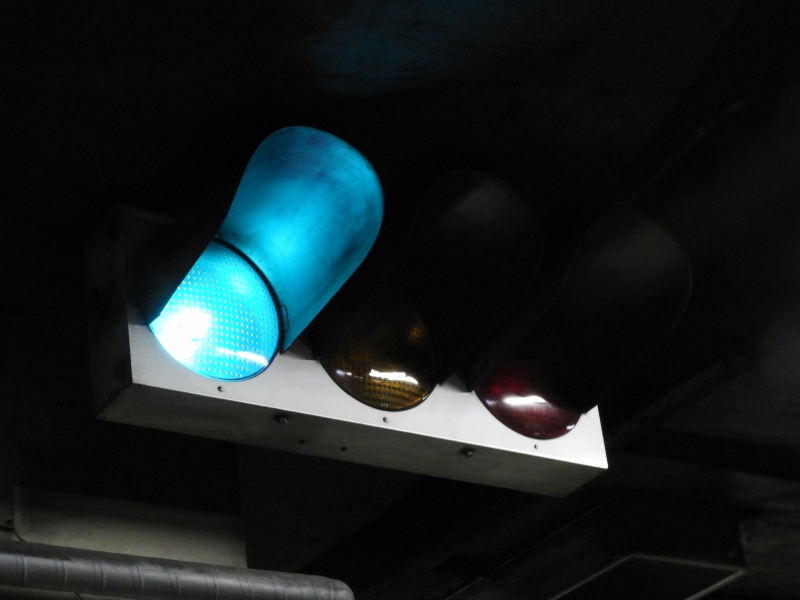
The image size is (800, 600). What are the coordinates of `green light` in the screenshot? It's located at pyautogui.click(x=221, y=314).